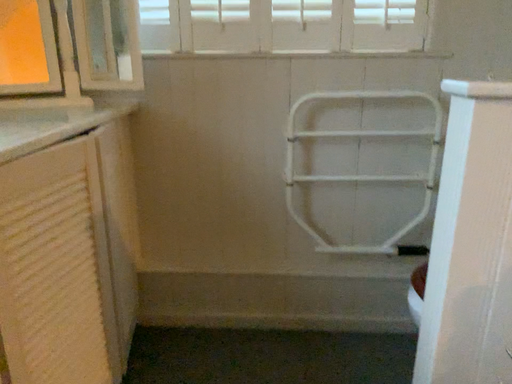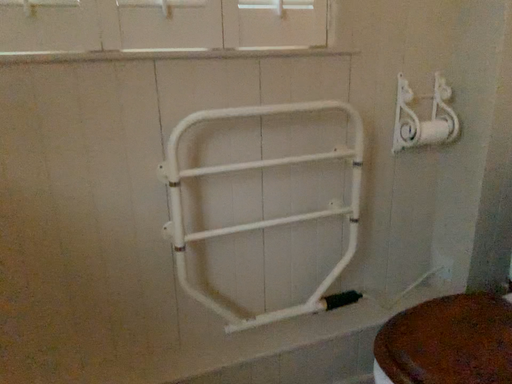
Question: Which way did the camera rotate in the video?

Choices:
 (A) rotated right
 (B) rotated left

Answer: (A)